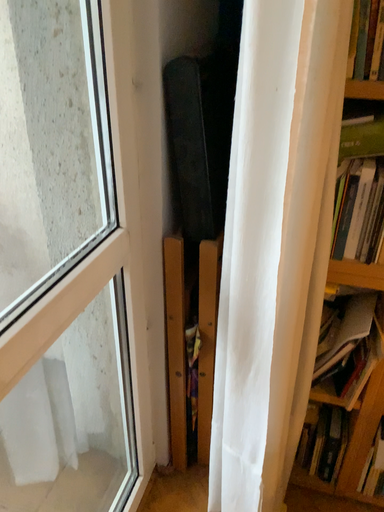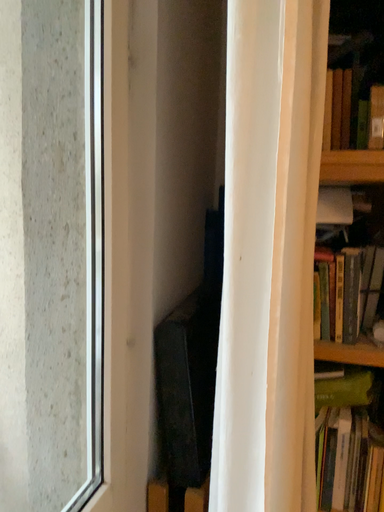
Question: How did the camera likely rotate when shooting the video?

Choices:
 (A) rotated downward
 (B) rotated upward

Answer: (B)